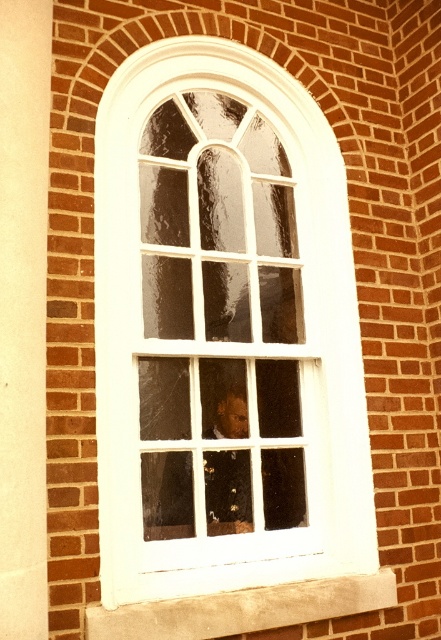
Question: Is white matte window frame at center wider than white concrete at lower center?

Choices:
 (A) yes
 (B) no

Answer: (B)

Question: Is smooth skin face at center positioned in front of white concrete at lower center?

Choices:
 (A) no
 (B) yes

Answer: (A)

Question: Which is farther from the white matte window frame at center?

Choices:
 (A) white concrete at lower center
 (B) smooth skin face at center

Answer: (A)

Question: Which of the following is the closest to the observer?

Choices:
 (A) smooth skin face at center
 (B) white matte window frame at center

Answer: (B)

Question: From the image, what is the correct spatial relationship of white matte window frame at center in relation to white concrete at lower center?

Choices:
 (A) above
 (B) below

Answer: (A)

Question: Which object is positioned farthest from the white matte window frame at center?

Choices:
 (A) smooth skin face at center
 (B) white concrete at lower center

Answer: (B)